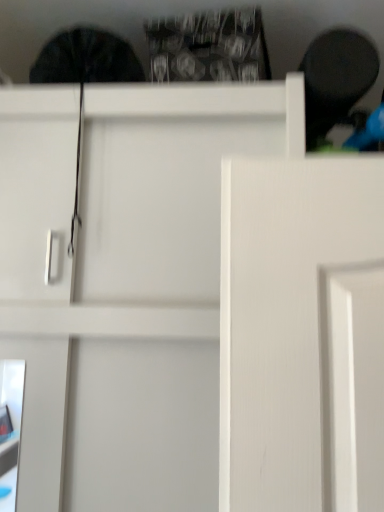
Question: Should I look upward or downward to see black matte swivel chair at upper right?

Choices:
 (A) down
 (B) up

Answer: (B)